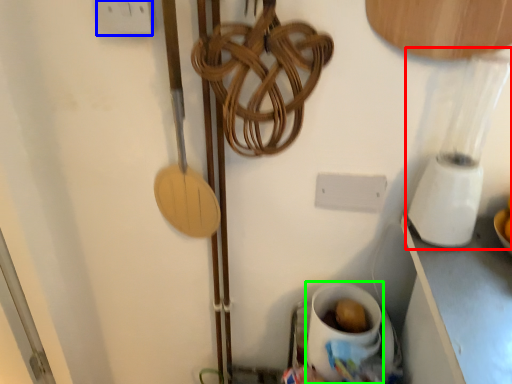
Question: Which is farther away from blender (highlighted by a red box)? electric outlet (highlighted by a blue box) or coffee cup (highlighted by a green box)?

Choices:
 (A) electric outlet
 (B) coffee cup

Answer: (A)